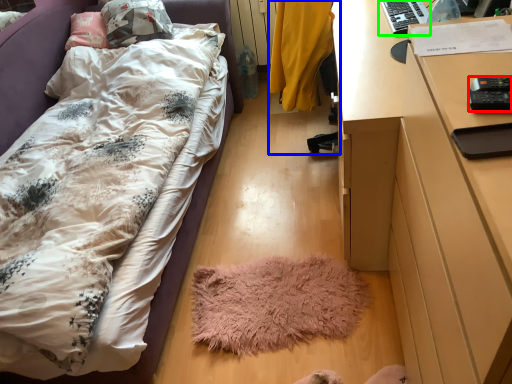
Question: Which is farther away from remote control (highlighted by a red box)? chair (highlighted by a blue box) or desktop (highlighted by a green box)?

Choices:
 (A) chair
 (B) desktop

Answer: (A)